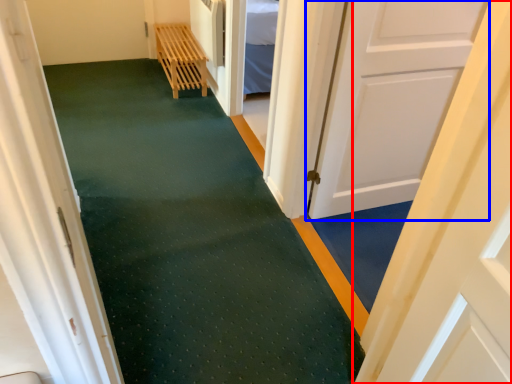
Question: Which object is closer to the camera taking this photo, door (highlighted by a red box) or door (highlighted by a blue box)?

Choices:
 (A) door
 (B) door

Answer: (A)